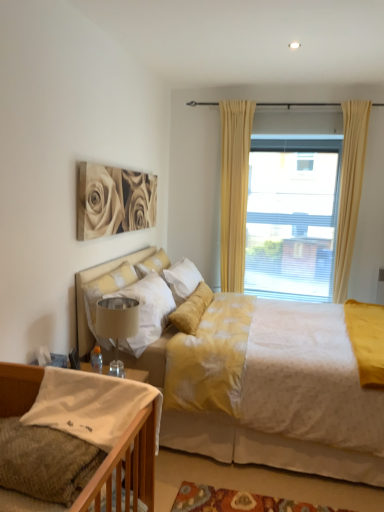
I want to click on empty space that is ontop of white cotton pillow at lower left, positioned as the third pillow in top-to-bottom order (from a real-world perspective), so click(x=53, y=436).